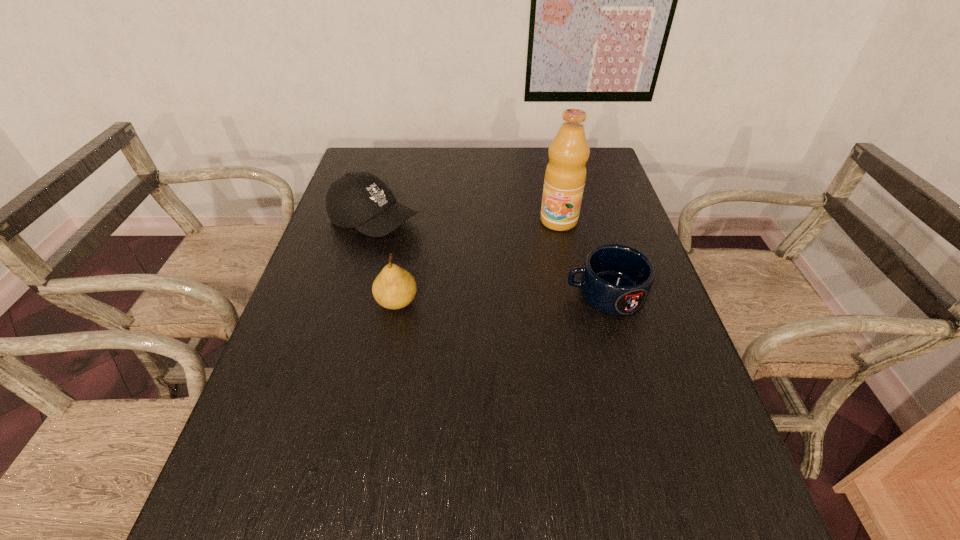
At what (x,y) coordinates should I click in order to perform the action: click on pear. Please return your answer as a coordinate pair (x, y). The height and width of the screenshot is (540, 960). Looking at the image, I should click on (394, 288).

Where is `mug`? mug is located at coordinates (616, 279).

Image resolution: width=960 pixels, height=540 pixels. What are the coordinates of `baseball cap` in the screenshot? It's located at (x=361, y=200).

This screenshot has width=960, height=540. I want to click on fruit juice, so click(x=565, y=175).

You are a GUI agent. You are given a task and a screenshot of the screen. Output one action in this format:
    pyautogui.click(x=<x>, y=<y>)
    Task: Click on the blank area located 0.370m on the back of the pear
    This screenshot has height=540, width=960.
    Given the screenshot: What is the action you would take?
    pyautogui.click(x=416, y=202)

You are a GUI agent. You are given a task and a screenshot of the screen. Output one action in this format:
    pyautogui.click(x=<x>, y=<y>)
    Task: Click on the vacant region located with the handle on the side of the shortest object
    This screenshot has height=540, width=960.
    Given the screenshot: What is the action you would take?
    pyautogui.click(x=468, y=294)

This screenshot has height=540, width=960. What are the coordinates of `free region located with the handle on the side of the shortest object` in the screenshot? It's located at 420,294.

Find the location of a particular element. vacant region located 0.230m with the handle on the side of the shortest object is located at coordinates pyautogui.click(x=472, y=294).

The height and width of the screenshot is (540, 960). What are the coordinates of `vacant space located 0.390m on the front-facing side of the baseball cap` in the screenshot? It's located at (529, 293).

Image resolution: width=960 pixels, height=540 pixels. Find the location of `free space located on the front-facing side of the baseball cap`. free space located on the front-facing side of the baseball cap is located at coordinates (426, 244).